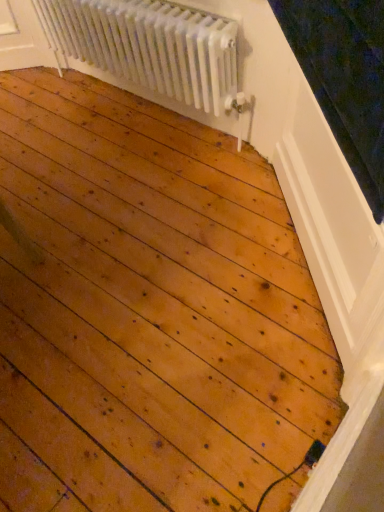
You are a GUI agent. You are given a task and a screenshot of the screen. Output one action in this format:
    pyautogui.click(x=<x>, y=<y>)
    Task: Click on the wooden at lower right
    The image size is (384, 512).
    Given the screenshot: What is the action you would take?
    pyautogui.click(x=351, y=459)

The height and width of the screenshot is (512, 384). Describe the element at coordinates (351, 459) in the screenshot. I see `wooden at lower right` at that location.

Where is `white metallic radiator at upper center`? white metallic radiator at upper center is located at coordinates (150, 46).

This screenshot has width=384, height=512. Describe the element at coordinates (150, 46) in the screenshot. I see `white metallic radiator at upper center` at that location.

Where is `wooden at lower right`? This screenshot has width=384, height=512. wooden at lower right is located at coordinates (351, 459).

Considering the positions of objects white metallic radiator at upper center and wooden at lower right in the image provided, who is more to the right, white metallic radiator at upper center or wooden at lower right?

wooden at lower right is more to the right.

Considering the positions of objects white metallic radiator at upper center and wooden at lower right in the image provided, who is in front, white metallic radiator at upper center or wooden at lower right?

Positioned in front is wooden at lower right.

Does point (114, 56) come behind point (304, 488)?

Yes, point (114, 56) is farther from viewer.

From the image's perspective, is white metallic radiator at upper center on wooden at lower right?

Correct, white metallic radiator at upper center appears higher than wooden at lower right in the image.

From a real-world perspective, does white metallic radiator at upper center stand above wooden at lower right?

Yes.

Considering the sizes of white metallic radiator at upper center and wooden at lower right in the image, is white metallic radiator at upper center wider or thinner than wooden at lower right?

white metallic radiator at upper center is wider than wooden at lower right.

From their relative heights in the image, would you say white metallic radiator at upper center is taller or shorter than wooden at lower right?

In the image, white metallic radiator at upper center appears to be taller than wooden at lower right.

Is white metallic radiator at upper center smaller than wooden at lower right?

Incorrect, white metallic radiator at upper center is not smaller in size than wooden at lower right.

Do you think white metallic radiator at upper center is within wooden at lower right, or outside of it?

white metallic radiator at upper center lies outside wooden at lower right.

Are white metallic radiator at upper center and wooden at lower right beside each other?

No, white metallic radiator at upper center is not making contact with wooden at lower right.

Is white metallic radiator at upper center oriented away from wooden at lower right?

white metallic radiator at upper center does not have its back to wooden at lower right.

Can you tell me how much white metallic radiator at upper center and wooden at lower right differ in facing direction?

The facing directions of white metallic radiator at upper center and wooden at lower right are 90.1 degrees apart.

How much distance is there between white metallic radiator at upper center and wooden at lower right?

white metallic radiator at upper center and wooden at lower right are 4.45 feet apart from each other.

This screenshot has height=512, width=384. In order to click on radiator above the wooden at lower right (from the image's perspective) in this screenshot , I will do `click(150, 46)`.

Which is more to the right, wooden at lower right or white metallic radiator at upper center?

Positioned to the right is wooden at lower right.

Is wooden at lower right positioned before white metallic radiator at upper center?

Yes, the depth of wooden at lower right is less than that of white metallic radiator at upper center.

Considering the points (376, 424) and (207, 61), which point is in front, point (376, 424) or point (207, 61)?

The point (376, 424) is in front.

From the image's perspective, is wooden at lower right located above or below white metallic radiator at upper center?

wooden at lower right is situated lower than white metallic radiator at upper center in the image.

Looking at this image, from a real-world perspective, is wooden at lower right above or below white metallic radiator at upper center?

wooden at lower right is situated lower than white metallic radiator at upper center in the real world.

Considering the sizes of objects wooden at lower right and white metallic radiator at upper center in the image provided, who is wider, wooden at lower right or white metallic radiator at upper center?

white metallic radiator at upper center.

From their relative heights in the image, would you say wooden at lower right is taller or shorter than white metallic radiator at upper center?

wooden at lower right is shorter than white metallic radiator at upper center.

Considering the relative sizes of wooden at lower right and white metallic radiator at upper center in the image provided, is wooden at lower right bigger than white metallic radiator at upper center?

Actually, wooden at lower right might be smaller than white metallic radiator at upper center.

Can we say wooden at lower right lies outside white metallic radiator at upper center?

wooden at lower right is positioned outside white metallic radiator at upper center.

Would you say wooden at lower right is a long distance from white metallic radiator at upper center?

Yes, wooden at lower right and white metallic radiator at upper center are quite far apart.

Does wooden at lower right turn towards white metallic radiator at upper center?

No, wooden at lower right is not aimed at white metallic radiator at upper center.

This screenshot has width=384, height=512. In the image, there is a wooden at lower right. What are the coordinates of `radiator above it (from the image's perspective)` in the screenshot? It's located at (150, 46).

Find the location of `radiator above the wooden at lower right (from the image's perspective)`. radiator above the wooden at lower right (from the image's perspective) is located at coordinates (150, 46).

The height and width of the screenshot is (512, 384). Identify the location of radiator located behind the wooden at lower right. [150, 46].